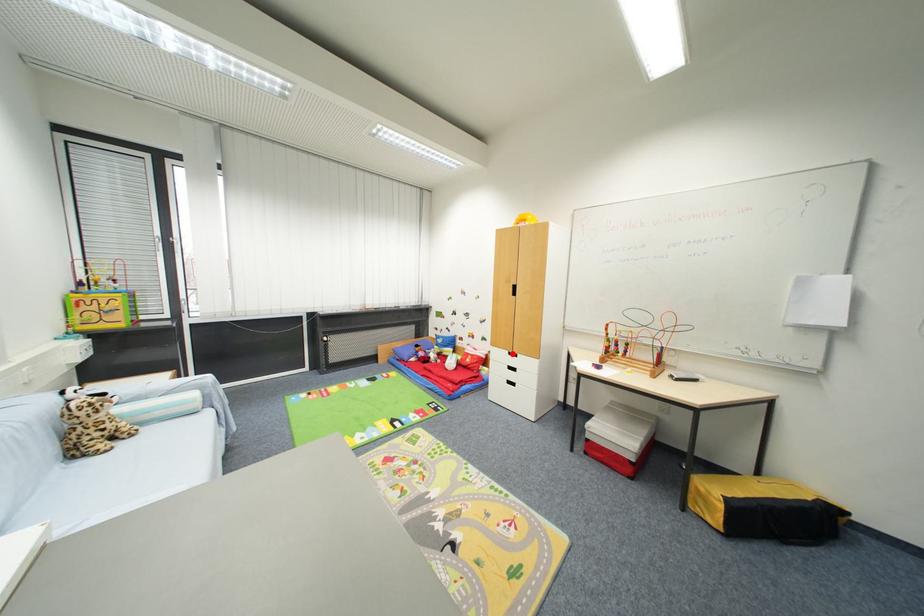
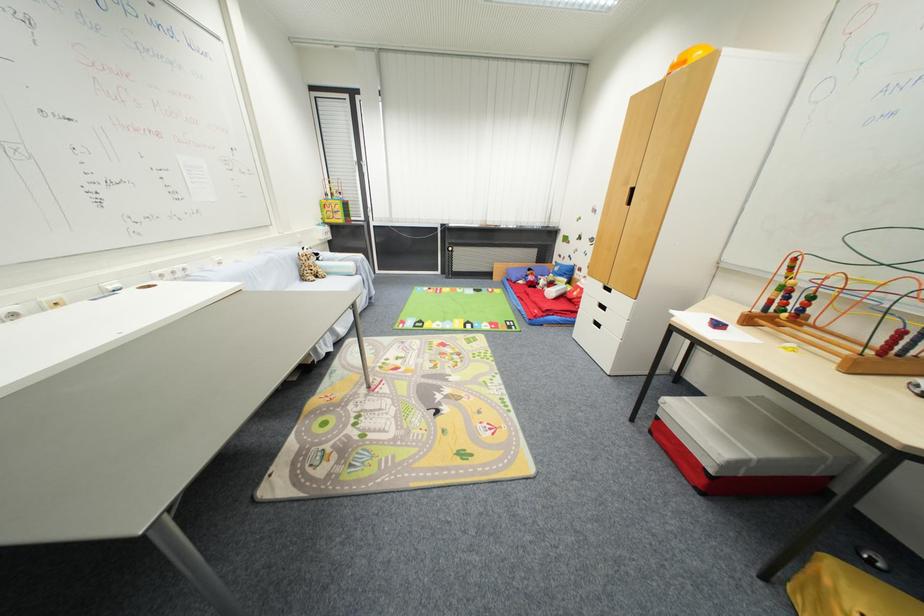
Question: I am providing you with two images of the same scene from different viewpoints. A red point is marked on the first image. Can you still see the location of the red point in image 2?

Choices:
 (A) Yes
 (B) No

Answer: (A)